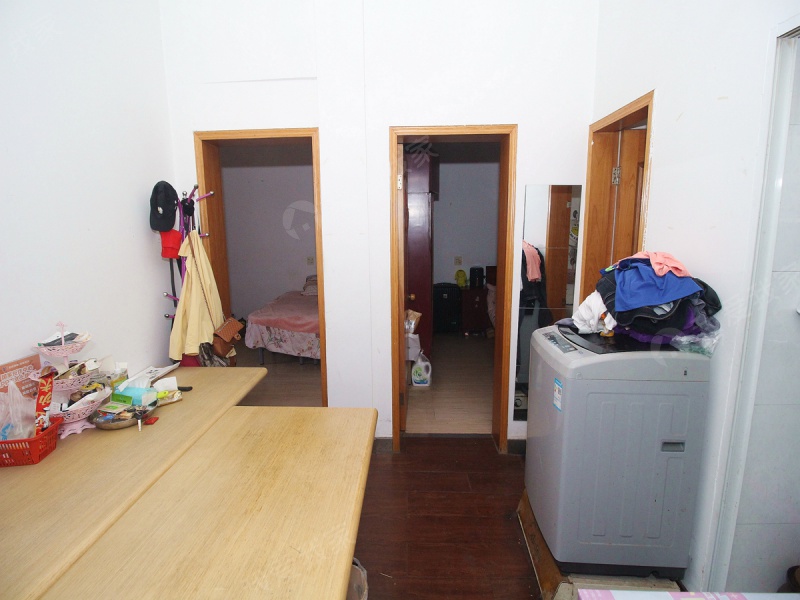
Locate an element on the screen. The image size is (800, 600). jacket holder is located at coordinates (174, 291).